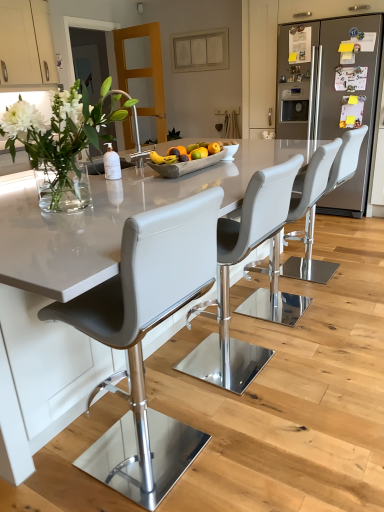
The height and width of the screenshot is (512, 384). Identify the location of vacant area to the right of gray leather bar stool at center, the third chair when ordered from front to back. (347, 310).